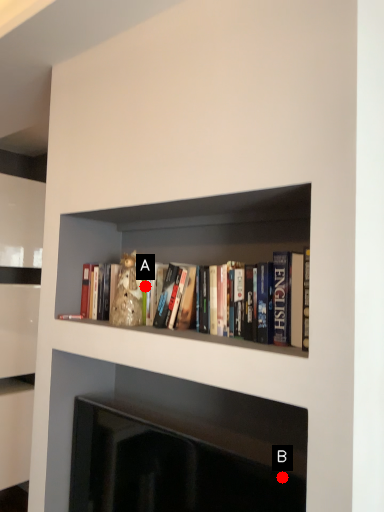
Question: Two points are circled on the image, labeled by A and B beside each circle. Which point is closer to the camera?

Choices:
 (A) A is closer
 (B) B is closer

Answer: (B)